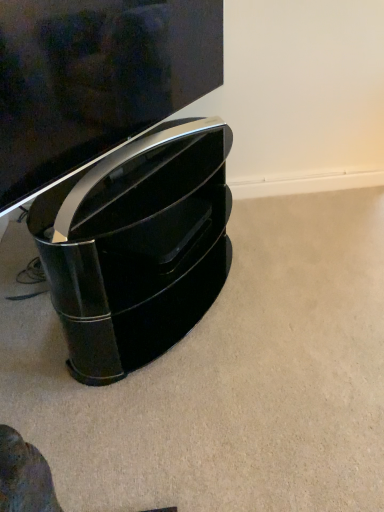
Describe the element at coordinates (95, 79) in the screenshot. I see `glossy black tv at upper center` at that location.

I want to click on glossy black tv at upper center, so click(95, 79).

You are a GUI agent. You are given a task and a screenshot of the screen. Output one action in this format:
    pyautogui.click(x=<x>, y=<y>)
    Task: Click on the glossy black speaker at lower left
    The image size is (384, 512).
    Given the screenshot: What is the action you would take?
    pyautogui.click(x=138, y=254)

What do you see at coordinates (138, 254) in the screenshot? The width and height of the screenshot is (384, 512). I see `glossy black speaker at lower left` at bounding box center [138, 254].

What are the coordinates of `glossy black tv at upper center` in the screenshot? It's located at (95, 79).

Is glossy black tv at upper center at the left side of glossy black speaker at lower left?

Yes.

Is glossy black tv at upper center behind glossy black speaker at lower left?

No, it is not.

Is point (190, 68) positioned before point (139, 226)?

No.

From the image's perspective, which object appears higher, glossy black tv at upper center or glossy black speaker at lower left?

glossy black tv at upper center appears higher in the image.

From a real-world perspective, which object stands above the other?

From a 3D spatial view, glossy black tv at upper center is above.

Considering the relative sizes of glossy black tv at upper center and glossy black speaker at lower left in the image provided, is glossy black tv at upper center wider than glossy black speaker at lower left?

In fact, glossy black tv at upper center might be narrower than glossy black speaker at lower left.

Does glossy black tv at upper center have a lesser height compared to glossy black speaker at lower left?

Yes, glossy black tv at upper center is shorter than glossy black speaker at lower left.

Which of these two, glossy black tv at upper center or glossy black speaker at lower left, is bigger?

With larger size is glossy black speaker at lower left.

Would you say glossy black tv at upper center is outside glossy black speaker at lower left?

Yes.

Would you say glossy black tv at upper center is a long distance from glossy black speaker at lower left?

No, glossy black tv at upper center is in close proximity to glossy black speaker at lower left.

Is glossy black speaker at lower left at the back of glossy black tv at upper center?

No, glossy black tv at upper center is not facing the opposite direction of glossy black speaker at lower left.

Identify the location of furniture behind the glossy black tv at upper center. (138, 254).

Between glossy black speaker at lower left and glossy black tv at upper center, which one appears on the left side from the viewer's perspective?

Positioned to the left is glossy black tv at upper center.

Which object is more forward, glossy black speaker at lower left or glossy black tv at upper center?

glossy black tv at upper center.

Which point is more forward, (116, 242) or (153, 3)?

Positioned in front is point (153, 3).

From the image's perspective, is glossy black speaker at lower left on glossy black tv at upper center?

No, from the image's perspective, glossy black speaker at lower left is not on top of glossy black tv at upper center.

Looking at this image, from a real-world perspective, is glossy black speaker at lower left physically above glossy black tv at upper center?

No.

Between glossy black speaker at lower left and glossy black tv at upper center, which one has larger width?

With larger width is glossy black speaker at lower left.

Considering the relative sizes of glossy black speaker at lower left and glossy black tv at upper center in the image provided, is glossy black speaker at lower left shorter than glossy black tv at upper center?

No.

Between glossy black speaker at lower left and glossy black tv at upper center, which one has smaller size?

glossy black tv at upper center is smaller.

Is glossy black speaker at lower left completely or partially outside of glossy black tv at upper center?

Absolutely, glossy black speaker at lower left is external to glossy black tv at upper center.

Is glossy black speaker at lower left far away from glossy black tv at upper center?

No, there isn't a large distance between glossy black speaker at lower left and glossy black tv at upper center.

Is glossy black speaker at lower left turned away from glossy black tv at upper center?

glossy black speaker at lower left is not turned away from glossy black tv at upper center.

Can you tell me how much glossy black speaker at lower left and glossy black tv at upper center differ in facing direction?

The angle between the facing direction of glossy black speaker at lower left and the facing direction of glossy black tv at upper center is 1.19 degrees.

Where is `television that appears above the glossy black speaker at lower left (from the image's perspective)`? This screenshot has height=512, width=384. television that appears above the glossy black speaker at lower left (from the image's perspective) is located at coordinates (95, 79).

Where is `television located in front of the glossy black speaker at lower left`? The height and width of the screenshot is (512, 384). television located in front of the glossy black speaker at lower left is located at coordinates (95, 79).

Identify the location of furniture below the glossy black tv at upper center (from a real-world perspective). (138, 254).